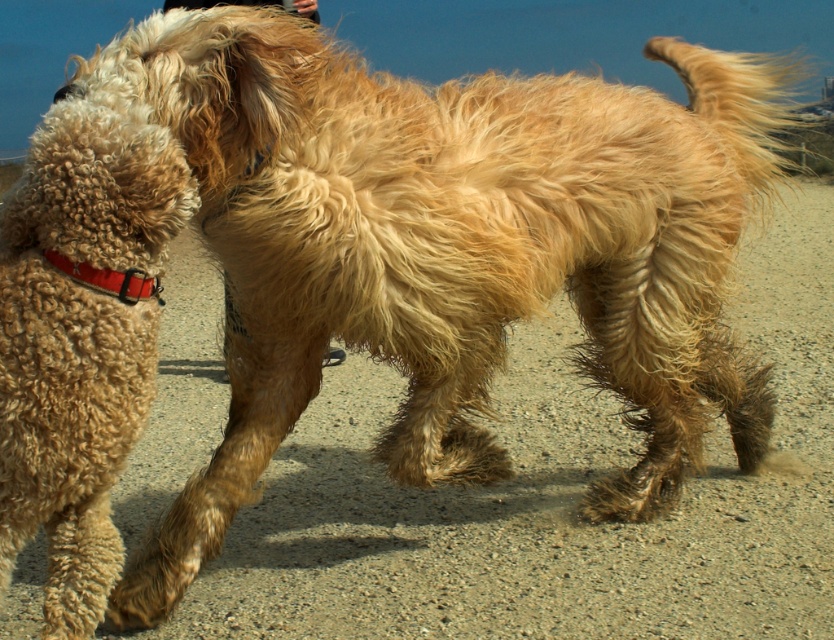
Question: Which point is closer to the camera?

Choices:
 (A) (124, 296)
 (B) (103, 282)

Answer: (B)

Question: Among these objects, which one is nearest to the camera?

Choices:
 (A) curly golden fur at left
 (B) red fabric collar at left

Answer: (A)

Question: Does curly golden fur at left have a smaller size compared to red fabric collar at left?

Choices:
 (A) no
 (B) yes

Answer: (A)

Question: Is curly golden fur at left closer to camera compared to red fabric collar at left?

Choices:
 (A) no
 (B) yes

Answer: (B)

Question: Does curly golden fur at left come in front of red fabric collar at left?

Choices:
 (A) no
 (B) yes

Answer: (B)

Question: Which of the following is the farthest from the observer?

Choices:
 (A) (109, 115)
 (B) (99, 285)

Answer: (A)